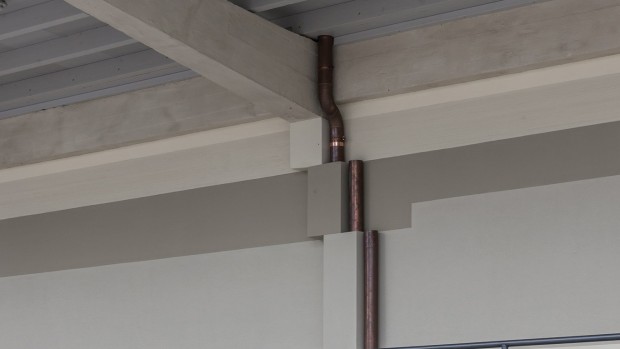
Find the location of a particular element. part of a wall is located at coordinates (348, 309), (306, 150).